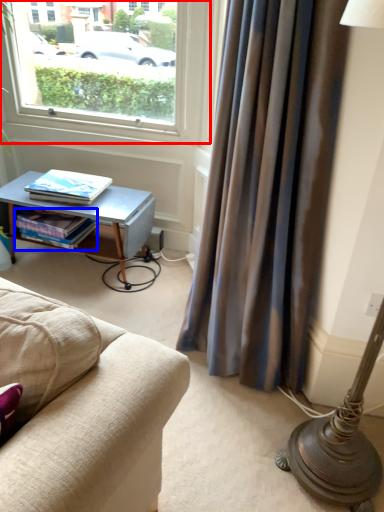
Question: Which object is closer to the camera taking this photo, window (highlighted by a red box) or book (highlighted by a blue box)?

Choices:
 (A) window
 (B) book

Answer: (A)